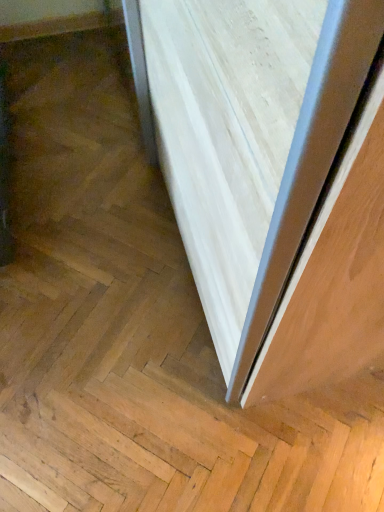
Where is `white wood door at center`? The width and height of the screenshot is (384, 512). white wood door at center is located at coordinates (271, 177).

In order to face white wood door at center, should I rotate leftwards or rightwards?

Turn left by 5.864 degrees to look at white wood door at center.

What do you see at coordinates (271, 177) in the screenshot?
I see `white wood door at center` at bounding box center [271, 177].

This screenshot has height=512, width=384. Identify the location of white wood door at center. (271, 177).